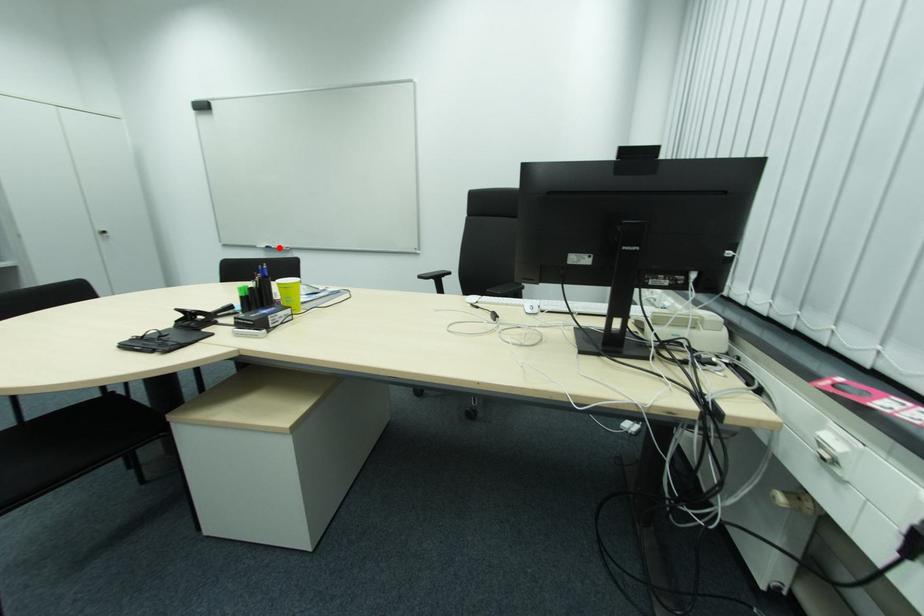
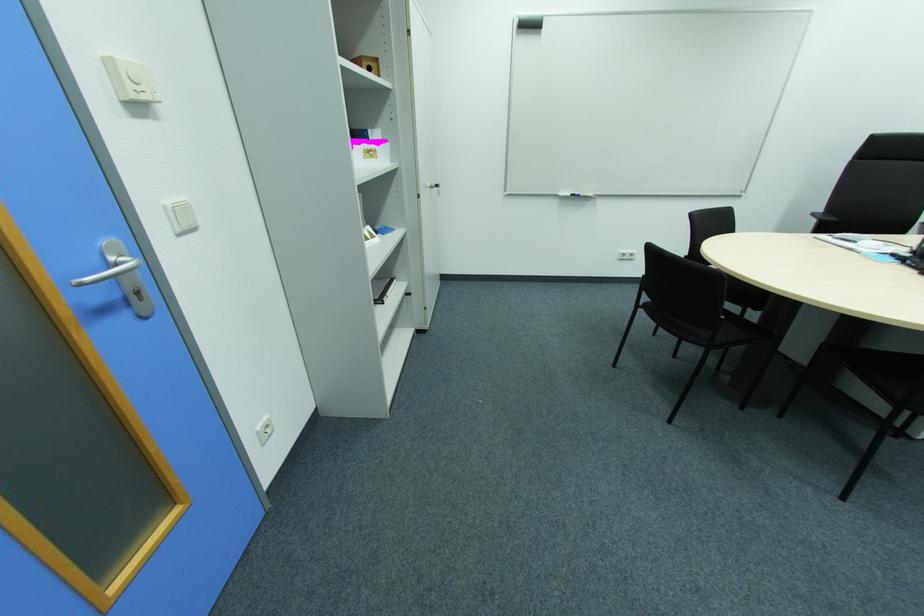
Question: I am providing you with two images of the same scene from different viewpoints. In image1, a red point is highlighted. Considering the same 3D point in image2, which of the following is correct?

Choices:
 (A) It is closer
 (B) It is farther

Answer: (A)